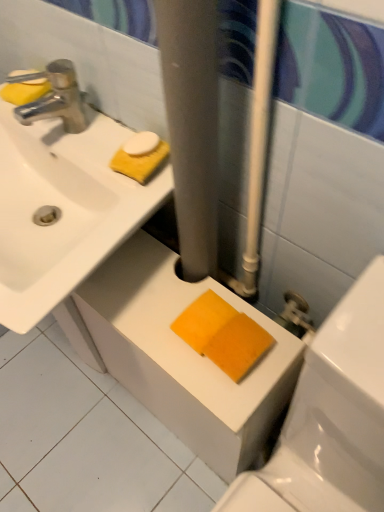
Locate an element on the screen. The width and height of the screenshot is (384, 512). free space above white glossy ceramic tile at lower center (from a real-world perspective) is located at coordinates [72, 429].